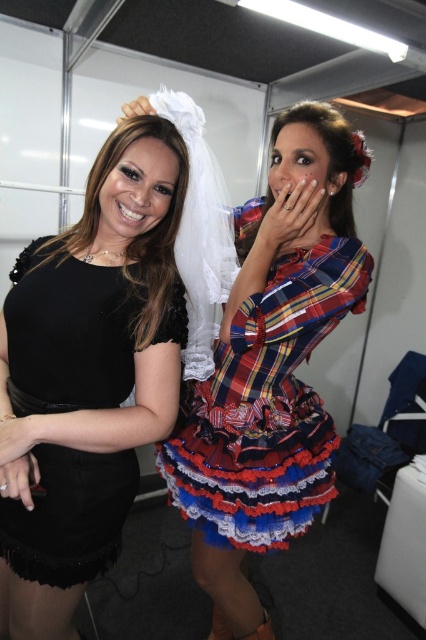
You are a fashion designer who needs to determine which dress requires more fabric for alterations. Based on the image, which dress between the plaid fabric dress at center and the black matte dress at left would need more fabric due to its size?

The plaid fabric dress at center requires more fabric for alterations because it has a larger size compared to the black matte dress at left.